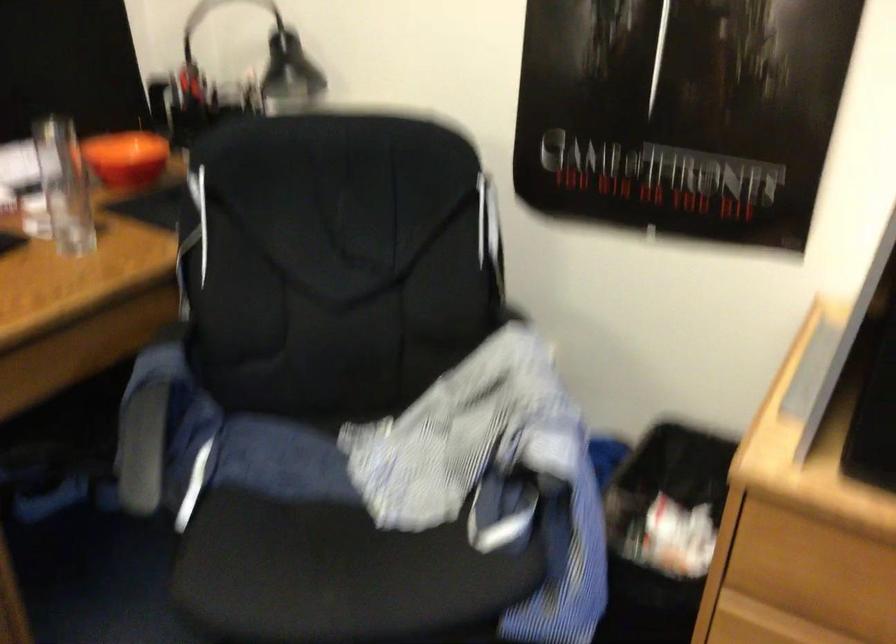
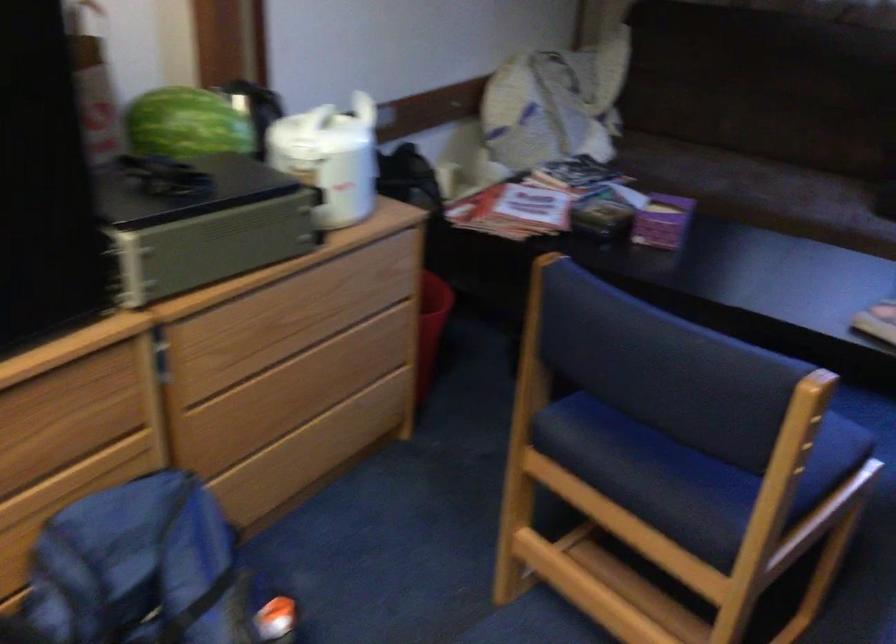
How did the camera likely rotate?

The rotation direction of the camera is right-down.